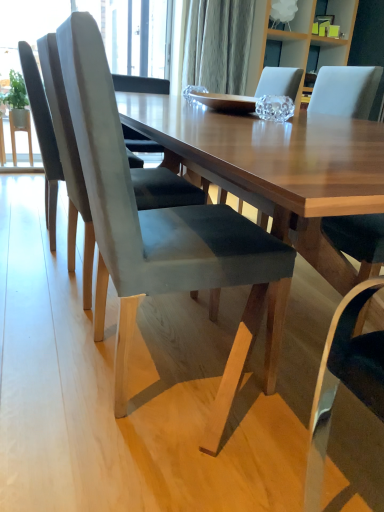
Question: Is suede gray chair at left, acting as the 1th chair starting from the back, not close to wooden table at center?

Choices:
 (A) yes
 (B) no

Answer: (B)

Question: Is suede gray chair at left, which is the 3th chair from front to back, placed right next to wooden table at center?

Choices:
 (A) yes
 (B) no

Answer: (B)

Question: Is suede gray chair at left, acting as the 1th chair starting from the back, thinner than wooden table at center?

Choices:
 (A) yes
 (B) no

Answer: (A)

Question: Does suede gray chair at left, which is the 3th chair from front to back, turn towards wooden table at center?

Choices:
 (A) yes
 (B) no

Answer: (B)

Question: Is suede gray chair at left, acting as the 1th chair starting from the back, in front of wooden table at center?

Choices:
 (A) no
 (B) yes

Answer: (A)

Question: From a real-world perspective, relative to suede gray chair at left, arranged as the 2th chair when viewed from the front, is suede gray chair at left, which is the 3th chair from front to back, vertically above or below?

Choices:
 (A) above
 (B) below

Answer: (B)

Question: Which is correct: suede gray chair at left, which is the 3th chair from front to back, is inside suede gray chair at left, which is the second chair in back-to-front order, or outside of it?

Choices:
 (A) outside
 (B) inside

Answer: (A)

Question: In the image, is suede gray chair at left, acting as the 1th chair starting from the back, positioned in front of or behind suede gray chair at left, arranged as the 2th chair when viewed from the front?

Choices:
 (A) front
 (B) behind

Answer: (B)

Question: Considering the positions of point (23, 40) and point (74, 181), is point (23, 40) closer or farther from the camera than point (74, 181)?

Choices:
 (A) closer
 (B) farther

Answer: (B)

Question: Is suede gray chair at left, acting as the 1th chair starting from the back, bigger or smaller than suede gray chair at center, which is the 1th chair in front-to-back order?

Choices:
 (A) big
 (B) small

Answer: (B)

Question: From the image's perspective, is suede gray chair at left, acting as the 1th chair starting from the back, located above or below suede gray chair at center, which is the 1th chair in front-to-back order?

Choices:
 (A) below
 (B) above

Answer: (B)

Question: Is suede gray chair at left, acting as the 1th chair starting from the back, situated inside suede gray chair at center, acting as the third chair starting from the back, or outside?

Choices:
 (A) inside
 (B) outside

Answer: (B)

Question: In the image, is suede gray chair at left, acting as the 1th chair starting from the back, on the left side or the right side of suede gray chair at center, acting as the third chair starting from the back?

Choices:
 (A) left
 (B) right

Answer: (A)

Question: Looking at their shapes, would you say wooden table at center is wider or thinner than suede gray chair at left, which is the second chair in back-to-front order?

Choices:
 (A) wide
 (B) thin

Answer: (A)

Question: Does point (345, 144) appear closer or farther from the camera than point (200, 203)?

Choices:
 (A) farther
 (B) closer

Answer: (B)